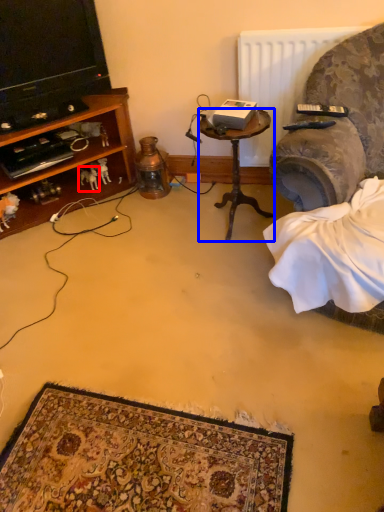
Question: Among these objects, which one is farthest to the camera, animal (highlighted by a red box) or desk (highlighted by a blue box)?

Choices:
 (A) animal
 (B) desk

Answer: (A)